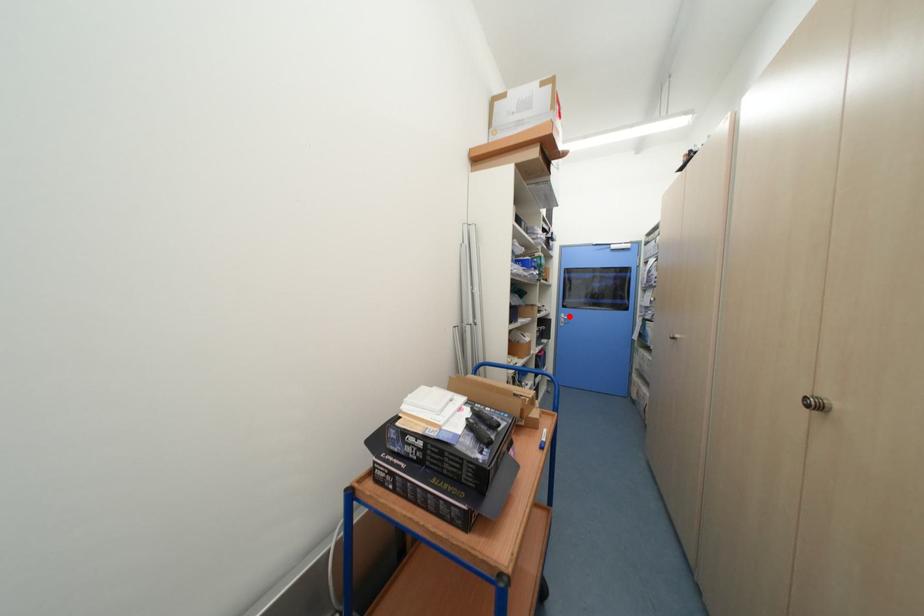
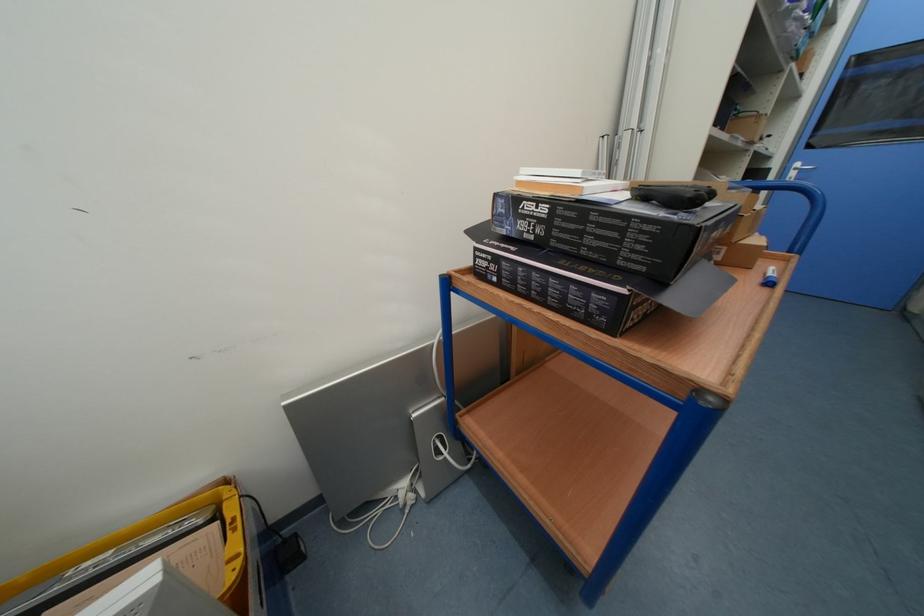
Question: A red point is marked in image1. In image2, is the corresponding 3D point closer to the camera or farther? Reply with the corresponding letter.

Choices:
 (A) The corresponding 3D point is closer.
 (B) The corresponding 3D point is farther.

Answer: (B)